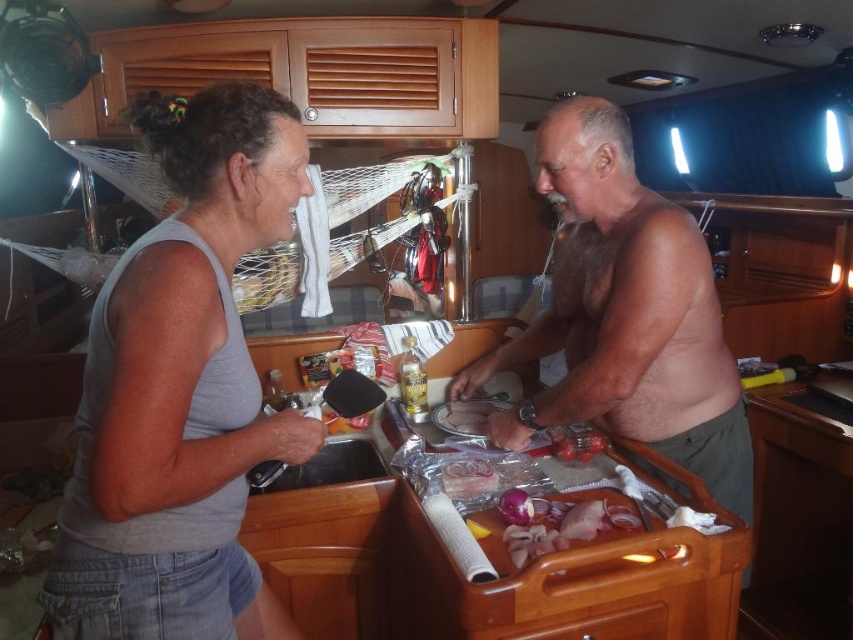
Question: Which of these objects is positioned closest to the shiny silver knife at center?

Choices:
 (A) gray fabric tank top at upper left
 (B) translucent plastic bag of onions at center
 (C) translucent plastic bag at center
 (D) gray cotton tank top at left

Answer: (B)

Question: Does gray fabric tank top at upper left appear over shiny silver knife at center?

Choices:
 (A) no
 (B) yes

Answer: (A)

Question: Can you confirm if gray fabric tank top at upper left is positioned to the right of shiny silver knife at center?

Choices:
 (A) yes
 (B) no

Answer: (B)

Question: Which point appears farthest from the camera in this image?

Choices:
 (A) (154, 230)
 (B) (339, 397)
 (C) (593, 518)
 (D) (630, 323)

Answer: (B)

Question: Does gray cotton tank top at left appear on the left side of translucent plastic bag of onions at center?

Choices:
 (A) yes
 (B) no

Answer: (A)

Question: Among these objects, which one is farthest from the camera?

Choices:
 (A) gray cotton tank top at left
 (B) gray fabric tank top at upper left
 (C) translucent plastic bag at center
 (D) black plastic sink at lower left

Answer: (C)